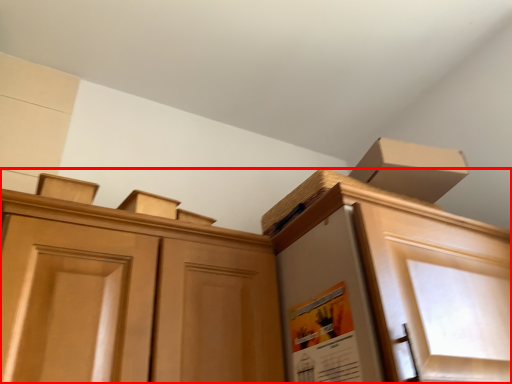
Question: From the image's perspective, where is cabinetry (annotated by the red box) located in relation to poster in the image?

Choices:
 (A) below
 (B) above

Answer: (B)